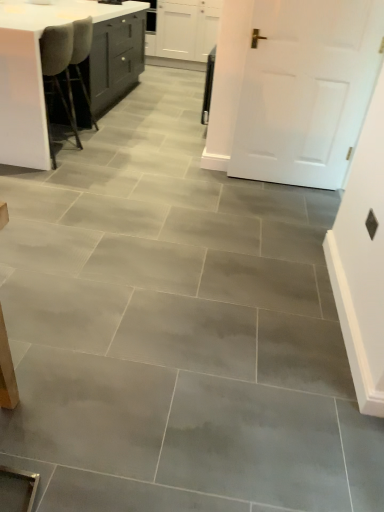
Question: Does white matte door at upper right lie behind white matte cabinet at upper center?

Choices:
 (A) yes
 (B) no

Answer: (B)

Question: Is white matte door at upper right next to white matte cabinet at upper center?

Choices:
 (A) no
 (B) yes

Answer: (A)

Question: Is white matte door at upper right thinner than white matte cabinet at upper center?

Choices:
 (A) no
 (B) yes

Answer: (B)

Question: Is white matte cabinet at upper center inside white matte door at upper right?

Choices:
 (A) no
 (B) yes

Answer: (A)

Question: Is white matte door at upper right oriented towards white matte cabinet at upper center?

Choices:
 (A) no
 (B) yes

Answer: (A)

Question: Is white matte door at upper right wider than white matte cabinet at upper center?

Choices:
 (A) no
 (B) yes

Answer: (A)

Question: Can you confirm if white matte door at upper right is taller than white glossy table at upper left?

Choices:
 (A) yes
 (B) no

Answer: (A)

Question: From the image's perspective, is white matte door at upper right below white glossy table at upper left?

Choices:
 (A) yes
 (B) no

Answer: (A)

Question: Is white matte door at upper right smaller than white glossy table at upper left?

Choices:
 (A) yes
 (B) no

Answer: (A)

Question: Is white glossy table at upper left completely or partially inside white matte door at upper right?

Choices:
 (A) yes
 (B) no

Answer: (B)

Question: Is white matte door at upper right at the left side of white glossy table at upper left?

Choices:
 (A) yes
 (B) no

Answer: (B)

Question: Is white matte door at upper right oriented towards white glossy table at upper left?

Choices:
 (A) no
 (B) yes

Answer: (A)

Question: Is white matte cabinet at upper center thinner than white glossy table at upper left?

Choices:
 (A) yes
 (B) no

Answer: (A)